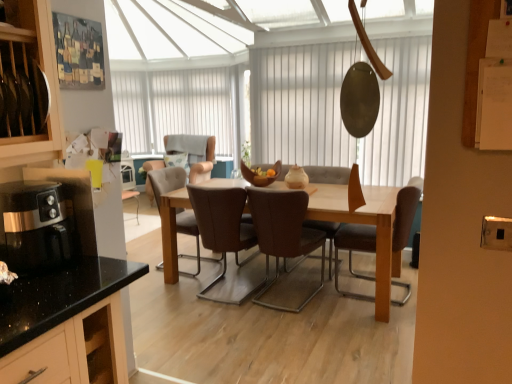
Describe the element at coordinates (166, 181) in the screenshot. I see `brown leather chair at center, arranged as the fifth chair when viewed from the front` at that location.

What is the approximate width of brown leather chair at center, the 5th chair when ordered from back to front?

The width of brown leather chair at center, the 5th chair when ordered from back to front, is 24.19 inches.

The height and width of the screenshot is (384, 512). Identify the location of brown leather chair at center, marked as the 3th chair in a front-to-back arrangement. (223, 228).

What do you see at coordinates (300, 105) in the screenshot? The width and height of the screenshot is (512, 384). I see `metallic gold window screen at center, which is counted as the 2th window screen, starting from the back` at bounding box center [300, 105].

How much space does metallic gold window screen at center, arranged as the 1th window screen when viewed from the front, occupy vertically?

metallic gold window screen at center, arranged as the 1th window screen when viewed from the front, is 1.43 meters in height.

The height and width of the screenshot is (384, 512). What do you see at coordinates (328, 174) in the screenshot?
I see `brown leather chair at center, marked as the third chair in a back-to-front arrangement` at bounding box center [328, 174].

The height and width of the screenshot is (384, 512). Find the location of `black glossy coffee machine at left`. black glossy coffee machine at left is located at coordinates (35, 226).

At what (x,y) coordinates should I click in order to perform the action: click on the 2nd chair to the right of the beige fabric chair at center, the sixth chair viewed from the front, counting from the anchor's position. Please return your answer as a coordinate pair (x, y). The height and width of the screenshot is (384, 512). Looking at the image, I should click on (223, 228).

In the scene shown: What's the angular difference between beige fabric chair at center, the sixth chair viewed from the front, and brown leather chair at center, marked as the 3th chair in a front-to-back arrangement,'s facing directions?

170 degrees.

From the picture: Is beige fabric chair at center, which is the first chair in back-to-front order, with brown leather chair at center, marked as the 3th chair in a front-to-back arrangement?

No, beige fabric chair at center, which is the first chair in back-to-front order, is not touching brown leather chair at center, marked as the 3th chair in a front-to-back arrangement.

Which is more to the right, black glossy coffee machine at left or white vertical blinds at upper center, which is counted as the second window screen, starting from the front?

From the viewer's perspective, black glossy coffee machine at left appears more on the right side.

Is the position of black glossy coffee machine at left more distant than that of white vertical blinds at upper center, which is the 2th window screen from right to left?

No, it is not.

Is black glossy coffee machine at left taller than white vertical blinds at upper center, the 1th window screen in the back-to-front sequence?

No.

In the scene shown: Is black glossy coffee machine at left turned away from white vertical blinds at upper center, which is counted as the second window screen, starting from the front?

black glossy coffee machine at left does not have its back to white vertical blinds at upper center, which is counted as the second window screen, starting from the front.

Can we say white vertical blinds at upper center, which is the 2th window screen from right to left, lies outside metallic gold window screen at center, which ranks as the first window screen in right-to-left order?

Yes, white vertical blinds at upper center, which is the 2th window screen from right to left, is outside of metallic gold window screen at center, which ranks as the first window screen in right-to-left order.

Is point (221, 70) positioned behind point (306, 143)?

Yes, it is behind point (306, 143).

Looking at this image, from the image's perspective, is white vertical blinds at upper center, the 1th window screen in the back-to-front sequence, over metallic gold window screen at center, which is counted as the 2th window screen, starting from the back?

Yes, from the image's perspective, white vertical blinds at upper center, the 1th window screen in the back-to-front sequence, is above metallic gold window screen at center, which is counted as the 2th window screen, starting from the back.

Could you measure the distance between white vertical blinds at upper center, the 1th window screen in the left-to-right sequence, and metallic gold window screen at center, which appears as the 2th window screen when viewed from the left?

white vertical blinds at upper center, the 1th window screen in the left-to-right sequence, and metallic gold window screen at center, which appears as the 2th window screen when viewed from the left, are 8.31 feet apart.

Considering the positions of objects black glossy coffee machine at left and beige fabric chair at center, the sixth chair viewed from the front, in the image provided, who is more to the right, black glossy coffee machine at left or beige fabric chair at center, the sixth chair viewed from the front,?

Positioned to the right is black glossy coffee machine at left.

How many degrees apart are the facing directions of black glossy coffee machine at left and beige fabric chair at center, the sixth chair viewed from the front?

The angular difference between black glossy coffee machine at left and beige fabric chair at center, the sixth chair viewed from the front, is 80.7 degrees.

Is point (31, 185) positioned in front of point (153, 165)?

Yes.

Locate an element on the screen. window screen that is the 2nd object to the left of the brown leather chair at center, which is the 2th chair from front to back, starting at the anchor is located at coordinates [x=176, y=107].

From the image's perspective, which one is positioned higher, white vertical blinds at upper center, the 1th window screen in the back-to-front sequence, or brown leather chair at center, the 5th chair when ordered from back to front?

white vertical blinds at upper center, the 1th window screen in the back-to-front sequence, appears higher in the image.

Which of these two, white vertical blinds at upper center, the 1th window screen in the left-to-right sequence, or brown leather chair at center, the 5th chair when ordered from back to front, is bigger?

Bigger between the two is white vertical blinds at upper center, the 1th window screen in the left-to-right sequence.

Could brown leather chair at center, the 5th chair when ordered from back to front, be considered to be inside white vertical blinds at upper center, which is the 2th window screen from right to left?

Actually, brown leather chair at center, the 5th chair when ordered from back to front, is outside white vertical blinds at upper center, which is the 2th window screen from right to left.

From a real-world perspective, which is physically above, brown leather chair at center, the 5th chair when ordered from back to front, or black glossy coffee machine at left?

black glossy coffee machine at left, from a real-world perspective.

Is brown leather chair at center, the 5th chair when ordered from back to front, taller than black glossy coffee machine at left?

Yes, brown leather chair at center, the 5th chair when ordered from back to front, is taller than black glossy coffee machine at left.

Which is correct: brown leather chair at center, which is the 2th chair from front to back, is inside black glossy coffee machine at left, or outside of it?

brown leather chair at center, which is the 2th chair from front to back, exists outside the volume of black glossy coffee machine at left.

From the image's perspective, is brown leather chair at center, the 5th chair when ordered from back to front, located above or below black glossy coffee machine at left?

Clearly, from the image's perspective, brown leather chair at center, the 5th chair when ordered from back to front, is below black glossy coffee machine at left.

Who is shorter, brown leather chair at center, acting as the 4th chair starting from the front, or metallic gold window screen at center, arranged as the 1th window screen when viewed from the front?

brown leather chair at center, acting as the 4th chair starting from the front, is shorter.

Is brown leather chair at center, marked as the third chair in a back-to-front arrangement, positioned with its back to metallic gold window screen at center, which appears as the 2th window screen when viewed from the left?

No, metallic gold window screen at center, which appears as the 2th window screen when viewed from the left, is not at the back of brown leather chair at center, marked as the third chair in a back-to-front arrangement.

Is brown leather chair at center, acting as the 4th chair starting from the front, far from metallic gold window screen at center, which is counted as the 2th window screen, starting from the back?

No.

Can you tell me how much brown leather chair at center, acting as the 4th chair starting from the front, and metallic gold window screen at center, which ranks as the first window screen in right-to-left order, differ in facing direction?

The angle between the facing direction of brown leather chair at center, acting as the 4th chair starting from the front, and the facing direction of metallic gold window screen at center, which ranks as the first window screen in right-to-left order, is 3.43 degrees.

From the beige fabric chair at center, which is the first chair in back-to-front order, count 3rd chairs forward and point to it. Please provide its 2D coordinates.

[(223, 228)]

Locate an element on the screen. The width and height of the screenshot is (512, 384). coffee machine below the white vertical blinds at upper center, the 1th window screen in the left-to-right sequence (from the image's perspective) is located at coordinates (35, 226).

Looking at the image, which one is located closer to brown leather chair at center, arranged as the 6th chair when viewed from the back, brown leather chair at center, the 5th chair when ordered from back to front, or metallic gold window screen at center, which is counted as the 2th window screen, starting from the back?

brown leather chair at center, the 5th chair when ordered from back to front.

Considering their positions, is brown leather chair at center, which is the 2th chair from front to back, positioned closer to brown leather chair at center, arranged as the fifth chair when viewed from the front, than brown leather chair at center, acting as the 4th chair starting from the front?

Among the two, brown leather chair at center, acting as the 4th chair starting from the front, is located nearer to brown leather chair at center, arranged as the fifth chair when viewed from the front.

Looking at the image, which one is located further to brown leather chair at center, marked as the third chair in a back-to-front arrangement, brown leather chair at center, arranged as the fifth chair when viewed from the front, or white vertical blinds at upper center, the 1th window screen in the left-to-right sequence?

Based on the image, white vertical blinds at upper center, the 1th window screen in the left-to-right sequence, appears to be further to brown leather chair at center, marked as the third chair in a back-to-front arrangement.

Estimate the real-world distances between objects in this image. Which object is closer to black glossy coffee machine at left, brown leather chair at center, marked as the 3th chair in a front-to-back arrangement, or brown leather chair at center, acting as the first chair starting from the front?

brown leather chair at center, marked as the 3th chair in a front-to-back arrangement, is closer to black glossy coffee machine at left.

Looking at the image, which one is located closer to brown leather chair at center, arranged as the 6th chair when viewed from the back, beige fabric chair at center, the sixth chair viewed from the front, or metallic gold window screen at center, which ranks as the first window screen in right-to-left order?

The object closer to brown leather chair at center, arranged as the 6th chair when viewed from the back, is beige fabric chair at center, the sixth chair viewed from the front.

When comparing their distances from brown leather chair at center, acting as the first chair starting from the front, does beige fabric chair at center, which is the first chair in back-to-front order, or black glossy coffee machine at left seem closer?

The object closer to brown leather chair at center, acting as the first chair starting from the front, is beige fabric chair at center, which is the first chair in back-to-front order.

When comparing their distances from brown leather chair at center, arranged as the fifth chair when viewed from the front, does metallic gold window screen at center, which is counted as the 2th window screen, starting from the back, or brown leather chair at center, which is the 2th chair from front to back, seem further?

Based on the image, brown leather chair at center, which is the 2th chair from front to back, appears to be further to brown leather chair at center, arranged as the fifth chair when viewed from the front.

Considering their positions, is brown leather chair at center, arranged as the fifth chair when viewed from the front, positioned closer to white vertical blinds at upper center, the 1th window screen in the back-to-front sequence, than brown leather chair at center, marked as the third chair in a back-to-front arrangement?

brown leather chair at center, arranged as the fifth chair when viewed from the front, lies closer to white vertical blinds at upper center, the 1th window screen in the back-to-front sequence, than the other object.

Find the location of `window screen positioned between brown leather chair at center, acting as the 4th chair starting from the front, and white vertical blinds at upper center, which is counted as the second window screen, starting from the front, from near to far`. window screen positioned between brown leather chair at center, acting as the 4th chair starting from the front, and white vertical blinds at upper center, which is counted as the second window screen, starting from the front, from near to far is located at coordinates (300, 105).

Locate an element on the screen. The height and width of the screenshot is (384, 512). window screen between black glossy coffee machine at left and beige fabric chair at center, which is the first chair in back-to-front order, in the front-back direction is located at coordinates tap(300, 105).

Locate an element on the screen. This screenshot has width=512, height=384. chair between brown leather chair at center, marked as the 3th chair in a front-to-back arrangement, and brown leather chair at center, acting as the 4th chair starting from the front, from left to right is located at coordinates (284, 234).

Identify the location of window screen located between brown leather chair at center, arranged as the 6th chair when viewed from the back, and white vertical blinds at upper center, the 1th window screen in the left-to-right sequence, in the depth direction. (x=300, y=105).